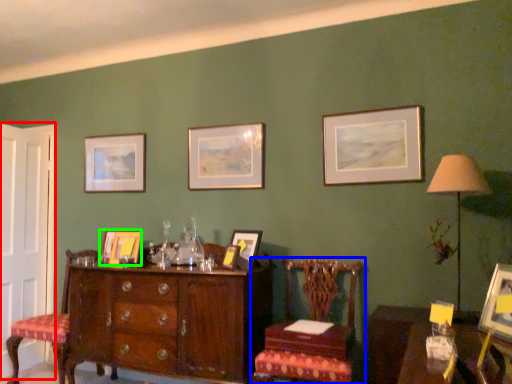
Question: Which is farther away from door (highlighted by a red box)? chair (highlighted by a blue box) or picture frame (highlighted by a green box)?

Choices:
 (A) chair
 (B) picture frame

Answer: (A)